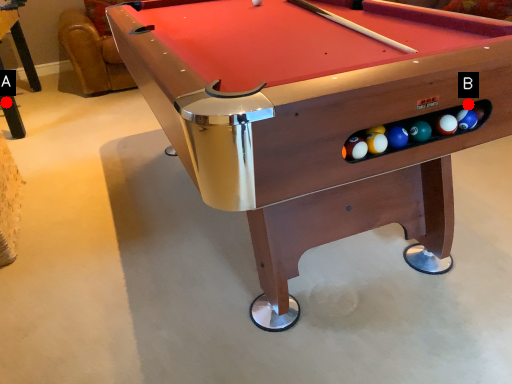
Question: Two points are circled on the image, labeled by A and B beside each circle. Which point appears farthest from the camera in this image?

Choices:
 (A) A is further
 (B) B is further

Answer: (A)